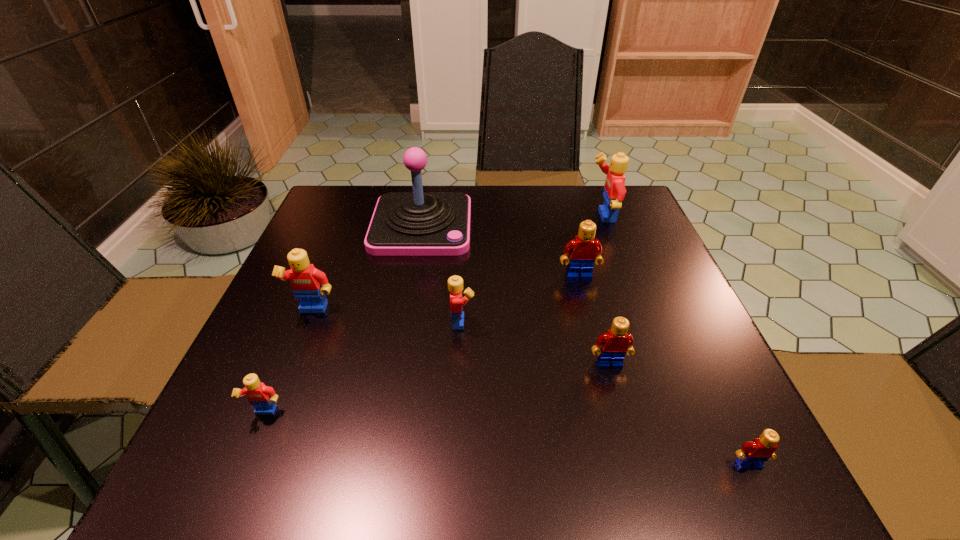
In the image, there is a desktop. Identify the location of free space at the far edge. This screenshot has height=540, width=960. (426, 192).

Where is `vacant space at the near edge`? vacant space at the near edge is located at coordinates (593, 474).

Image resolution: width=960 pixels, height=540 pixels. Identify the location of free spot at the left edge of the desktop. (320, 338).

Find the location of a particular element. free space at the right edge of the desktop is located at coordinates (671, 335).

In the image, there is a desktop. Identify the location of free space at the far right corner. (630, 198).

Identify the location of free space between the tallest Lego and the smallest yellow Lego. (434, 315).

Locate an element on the screen. This screenshot has width=960, height=540. free space between the third smallest yellow Lego and the third Lego from left to right is located at coordinates (388, 316).

Locate an element on the screen. unoccupied area between the seventh farthest object and the nearest object is located at coordinates (507, 439).

Locate an element on the screen. This screenshot has height=540, width=960. free spot between the biggest red Lego and the nearest Lego is located at coordinates (663, 371).

Find the location of a particular element. The width and height of the screenshot is (960, 540). free space between the nearest object and the farthest red Lego is located at coordinates pyautogui.click(x=663, y=371).